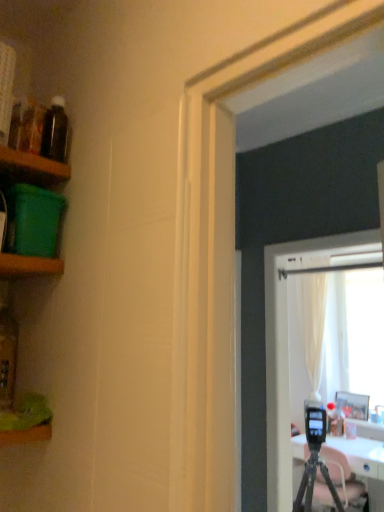
Image resolution: width=384 pixels, height=512 pixels. What do you see at coordinates (7, 347) in the screenshot?
I see `translucent glass bottle at left, which is the 1th bottle in bottom-to-top order` at bounding box center [7, 347].

The width and height of the screenshot is (384, 512). What do you see at coordinates (29, 266) in the screenshot?
I see `green wood shelf at left, which ranks as the third shelf in top-to-bottom order` at bounding box center [29, 266].

Locate an element on the screen. The image size is (384, 512). green wood shelf at left, which ranks as the third shelf in top-to-bottom order is located at coordinates (29, 266).

The image size is (384, 512). In order to click on black matte tripod at lower right in this screenshot , I will do `click(342, 476)`.

This screenshot has width=384, height=512. What do you see at coordinates (32, 167) in the screenshot?
I see `green plastic container at left, the 1th shelf in the top-to-bottom sequence` at bounding box center [32, 167].

The image size is (384, 512). What are the coordinates of `translucent glass bottle at left, which is the 1th bottle in bottom-to-top order` in the screenshot? It's located at (7, 347).

Looking at the image, does green plastic container at left, which ranks as the third shelf in bottom-to-top order, seem bigger or smaller compared to green wood shelf at left, which ranks as the third shelf in top-to-bottom order?

Clearly, green plastic container at left, which ranks as the third shelf in bottom-to-top order, is larger in size than green wood shelf at left, which ranks as the third shelf in top-to-bottom order.

Is green plastic container at left, which ranks as the third shelf in bottom-to-top order, behind green wood shelf at left, which ranks as the third shelf in top-to-bottom order?

Yes, green plastic container at left, which ranks as the third shelf in bottom-to-top order, is further from the viewer.

From the picture: From their relative heights in the image, would you say green plastic container at left, which ranks as the third shelf in bottom-to-top order, is taller or shorter than green wood shelf at left, the 1th shelf ordered from the bottom?

green plastic container at left, which ranks as the third shelf in bottom-to-top order, is taller than green wood shelf at left, the 1th shelf ordered from the bottom.

From a real-world perspective, relative to green wood shelf at left, the 1th shelf ordered from the bottom, is green plastic container at left, the 1th shelf in the top-to-bottom sequence, vertically above or below?

green plastic container at left, the 1th shelf in the top-to-bottom sequence, is above green wood shelf at left, the 1th shelf ordered from the bottom.

Where is `bottle that is behind the translucent glass bottle at left, which is counted as the second bottle, starting from the top`? Image resolution: width=384 pixels, height=512 pixels. bottle that is behind the translucent glass bottle at left, which is counted as the second bottle, starting from the top is located at coordinates (55, 131).

Do you think translucent glass bottle at upper left, marked as the 2th bottle in a left-to-right arrangement, is within translucent glass bottle at left, which is counted as the second bottle, starting from the top, or outside of it?

The correct answer is: outside.

Which point is more forward, [67,140] or [4,383]?

The point [4,383] is in front.

At what (x,y) coordinates should I click in order to perform the action: click on the 2nd bottle in front when counting from the black matte tripod at lower right. Please return your answer as a coordinate pair (x, y). Image resolution: width=384 pixels, height=512 pixels. Looking at the image, I should click on (7, 347).

Which is farther from the camera, (7,342) or (321,475)?

The point (321,475) is more distant.

Does translucent glass bottle at left, which is the 1th bottle in bottom-to-top order, come behind black matte tripod at lower right?

No, the depth of translucent glass bottle at left, which is the 1th bottle in bottom-to-top order, is less than that of black matte tripod at lower right.

Is green plastic container at left, the 1th shelf in the top-to-bottom sequence, at the back of black matte tripod at lower right?

No.

Does black matte tripod at lower right lie behind green plastic container at left, which ranks as the third shelf in bottom-to-top order?

Yes.

Is black matte tripod at lower right far from green plastic container at left, the 1th shelf in the top-to-bottom sequence?

Indeed, black matte tripod at lower right is not near green plastic container at left, the 1th shelf in the top-to-bottom sequence.

Between black matte tripod at lower right and green plastic container at left, which ranks as the third shelf in bottom-to-top order, which one has smaller width?

With smaller width is green plastic container at left, which ranks as the third shelf in bottom-to-top order.

Is green plastic container at left, which ranks as the third shelf in bottom-to-top order, not within green plastic container at left, which appears as the second shelf when viewed from the top?

Indeed, green plastic container at left, which ranks as the third shelf in bottom-to-top order, is completely outside green plastic container at left, which appears as the second shelf when viewed from the top.

In terms of size, does green plastic container at left, the 1th shelf in the top-to-bottom sequence, appear bigger or smaller than green plastic container at left, marked as the 2th shelf in a bottom-to-top arrangement?

green plastic container at left, the 1th shelf in the top-to-bottom sequence, is bigger than green plastic container at left, marked as the 2th shelf in a bottom-to-top arrangement.

In the image, is green plastic container at left, which ranks as the third shelf in bottom-to-top order, on the left side or the right side of green plastic container at left, marked as the 2th shelf in a bottom-to-top arrangement?

green plastic container at left, which ranks as the third shelf in bottom-to-top order, is to the left of green plastic container at left, marked as the 2th shelf in a bottom-to-top arrangement.

Between point (55, 173) and point (25, 159), which one is positioned behind?

Point (55, 173)

Looking at this image, from a real-world perspective, is translucent glass bottle at left, placed as the first bottle when sorted from left to right, positioned above or below green wood shelf at left, the 1th shelf ordered from the bottom?

In terms of real-world spatial position, translucent glass bottle at left, placed as the first bottle when sorted from left to right, is below green wood shelf at left, the 1th shelf ordered from the bottom.

Does translucent glass bottle at left, which is the 1th bottle in bottom-to-top order, have a lesser width compared to green wood shelf at left, the 1th shelf ordered from the bottom?

Correct, the width of translucent glass bottle at left, which is the 1th bottle in bottom-to-top order, is less than that of green wood shelf at left, the 1th shelf ordered from the bottom.

From the translucent glass bottle at left, the second bottle in the right-to-left sequence, count the 2nd shelf to the left and point to it. Please provide its 2D coordinates.

[(29, 266)]

Is green plastic container at left, marked as the 2th shelf in a bottom-to-top arrangement, directly adjacent to translucent glass bottle at upper left, which is the 1th bottle in right-to-left order?

green plastic container at left, marked as the 2th shelf in a bottom-to-top arrangement, is not next to translucent glass bottle at upper left, which is the 1th bottle in right-to-left order, and they're not touching.

Between green plastic container at left, which appears as the second shelf when viewed from the top, and translucent glass bottle at upper left, the 2th bottle ordered from the bottom, which one has more height?

With more height is green plastic container at left, which appears as the second shelf when viewed from the top.

Considering the positions of objects green plastic container at left, marked as the 2th shelf in a bottom-to-top arrangement, and translucent glass bottle at upper left, which is the 1th bottle in right-to-left order, in the image provided, who is behind, green plastic container at left, marked as the 2th shelf in a bottom-to-top arrangement, or translucent glass bottle at upper left, which is the 1th bottle in right-to-left order,?

translucent glass bottle at upper left, which is the 1th bottle in right-to-left order.

From a real-world perspective, which shelf is the 2nd one above the green wood shelf at left, which ranks as the third shelf in top-to-bottom order? Please provide its 2D coordinates.

[(32, 167)]

At what (x,y) coordinates should I click in order to perform the action: click on bottle that is under the translucent glass bottle at upper left, marked as the 2th bottle in a left-to-right arrangement (from a real-world perspective). Please return your answer as a coordinate pair (x, y). Image resolution: width=384 pixels, height=512 pixels. Looking at the image, I should click on (7, 347).

Estimate the real-world distances between objects in this image. Which object is closer to green plastic container at left, the 1th shelf in the top-to-bottom sequence, green plastic container at left, marked as the 2th shelf in a bottom-to-top arrangement, or translucent glass bottle at upper left, which is the 1th bottle in right-to-left order?

green plastic container at left, marked as the 2th shelf in a bottom-to-top arrangement.

Which object lies nearer to the anchor point green plastic container at left, which appears as the second shelf when viewed from the top, translucent glass bottle at upper left, marked as the 2th bottle in a left-to-right arrangement, or translucent glass bottle at left, which is counted as the second bottle, starting from the top?

translucent glass bottle at upper left, marked as the 2th bottle in a left-to-right arrangement, is closer to green plastic container at left, which appears as the second shelf when viewed from the top.

Based on their spatial positions, is green wood shelf at left, which ranks as the third shelf in top-to-bottom order, or green plastic container at left, marked as the 2th shelf in a bottom-to-top arrangement, further from translucent glass bottle at left, the second bottle in the right-to-left sequence?

Among the two, green plastic container at left, marked as the 2th shelf in a bottom-to-top arrangement, is located further to translucent glass bottle at left, the second bottle in the right-to-left sequence.

Based on their spatial positions, is translucent glass bottle at upper left, which is the 1th bottle in right-to-left order, or green wood shelf at left, the 1th shelf ordered from the bottom, closer to translucent glass bottle at left, the second bottle in the right-to-left sequence?

Based on the image, green wood shelf at left, the 1th shelf ordered from the bottom, appears to be nearer to translucent glass bottle at left, the second bottle in the right-to-left sequence.

From the image, which object appears to be farther from black matte tripod at lower right, translucent glass bottle at upper left, positioned as the 1th bottle in top-to-bottom order, or green plastic container at left, which ranks as the third shelf in bottom-to-top order?

Among the two, translucent glass bottle at upper left, positioned as the 1th bottle in top-to-bottom order, is located further to black matte tripod at lower right.

When comparing their distances from green plastic container at left, the 1th shelf in the top-to-bottom sequence, does translucent glass bottle at upper left, positioned as the 1th bottle in top-to-bottom order, or green plastic container at left, marked as the 2th shelf in a bottom-to-top arrangement, seem further?

translucent glass bottle at upper left, positioned as the 1th bottle in top-to-bottom order.

When comparing their distances from green plastic container at left, marked as the 2th shelf in a bottom-to-top arrangement, does green plastic container at left, which ranks as the third shelf in bottom-to-top order, or wooden picture frame at right seem further?

Among the two, wooden picture frame at right is located further to green plastic container at left, marked as the 2th shelf in a bottom-to-top arrangement.

Based on their spatial positions, is translucent glass bottle at left, the second bottle in the right-to-left sequence, or green plastic container at left, the 1th shelf in the top-to-bottom sequence, further from green wood shelf at left, the 1th shelf ordered from the bottom?

green plastic container at left, the 1th shelf in the top-to-bottom sequence.

Image resolution: width=384 pixels, height=512 pixels. I want to click on shelf between green plastic container at left, the 1th shelf in the top-to-bottom sequence, and wooden picture frame at right, along the z-axis, so click(32, 168).

Locate an element on the screen. The height and width of the screenshot is (512, 384). shelf located between green plastic container at left, the 1th shelf in the top-to-bottom sequence, and black matte tripod at lower right in the depth direction is located at coordinates (32, 168).

Identify the location of tripod between green plastic container at left, which ranks as the third shelf in bottom-to-top order, and wooden picture frame at right from front to back. This screenshot has height=512, width=384. (342, 476).

Find the location of a particular element. This screenshot has height=512, width=384. tripod between translucent glass bottle at upper left, positioned as the 1th bottle in top-to-bottom order, and wooden picture frame at right, along the z-axis is located at coordinates (342, 476).